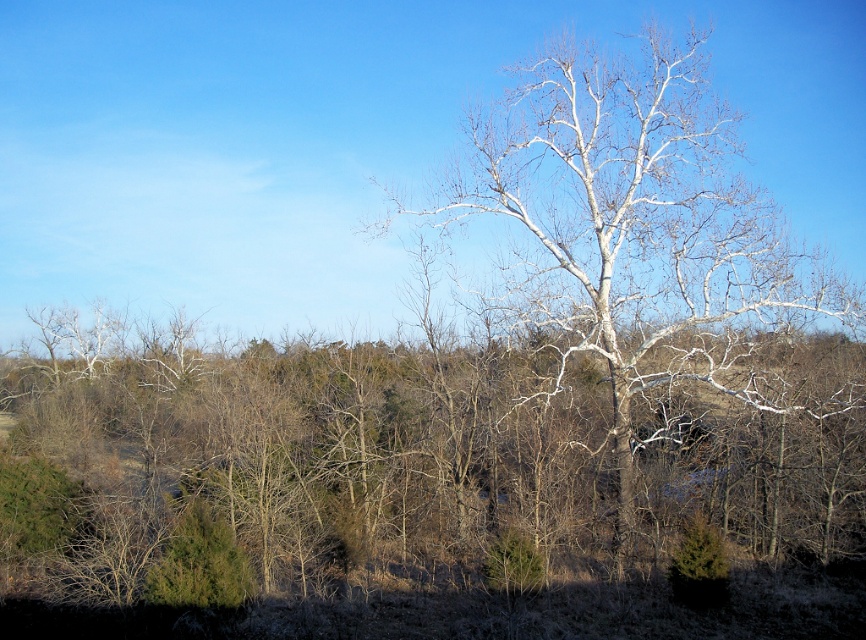
Question: Can you confirm if bare branches at center is wider than white bark tree at center?

Choices:
 (A) no
 (B) yes

Answer: (B)

Question: Is bare branches at center thinner than white bark tree at center?

Choices:
 (A) yes
 (B) no

Answer: (B)

Question: Among these points, which one is nearest to the camera?

Choices:
 (A) (858, 404)
 (B) (671, 378)

Answer: (B)

Question: Which object is farther from the camera taking this photo?

Choices:
 (A) bare branches at center
 (B) white bark tree at center

Answer: (B)

Question: Is bare branches at center positioned in front of white bark tree at center?

Choices:
 (A) no
 (B) yes

Answer: (B)